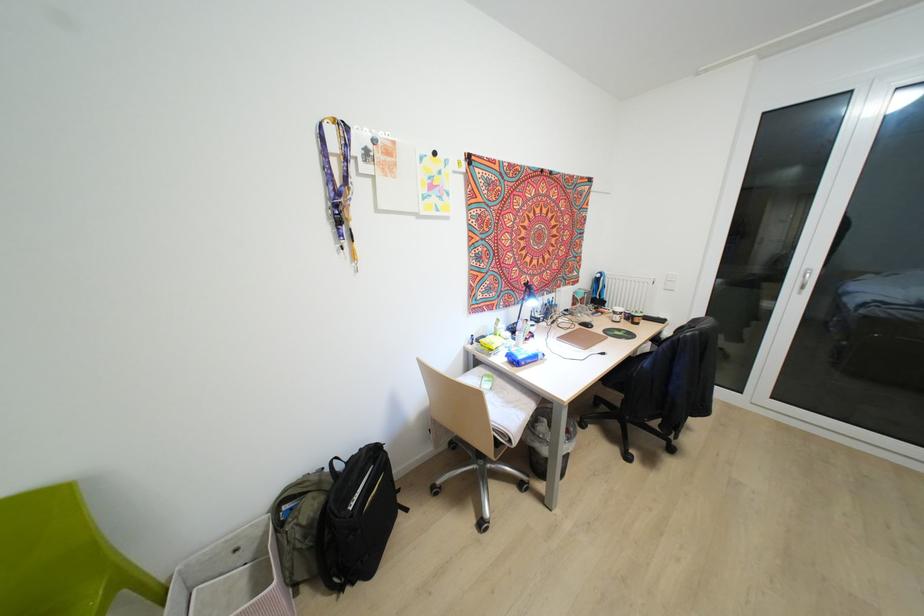
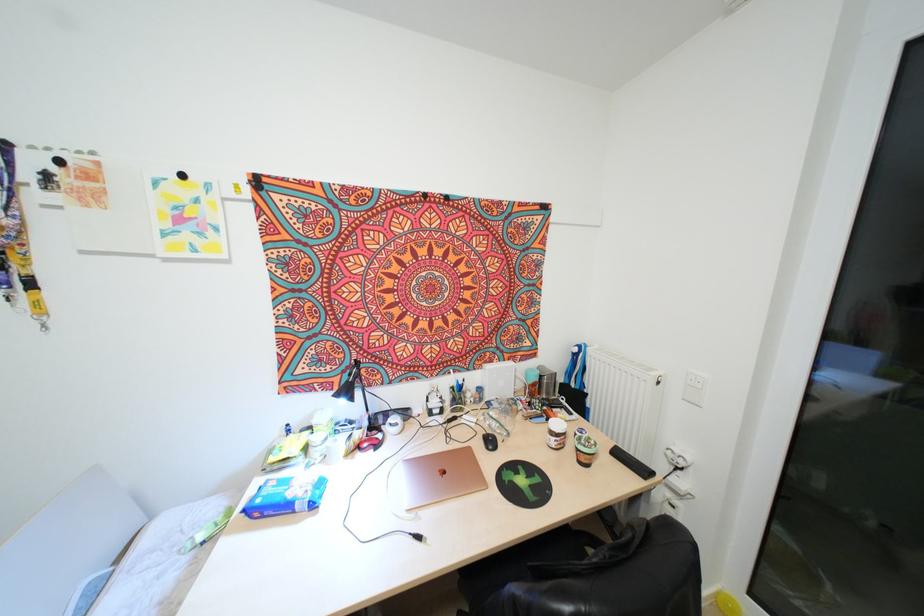
The point at (x=523, y=363) is marked in the first image. Where is the corresponding point in the second image?

(256, 514)